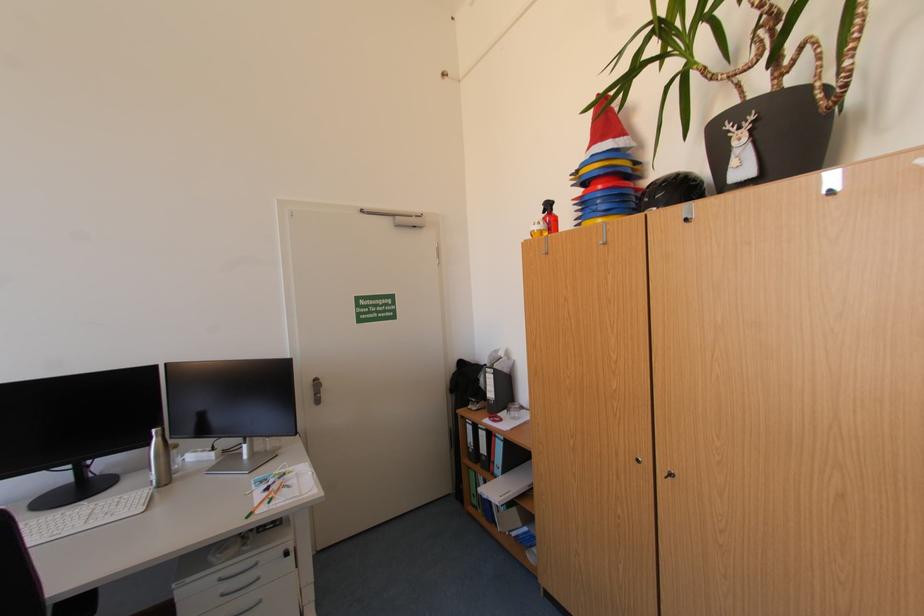
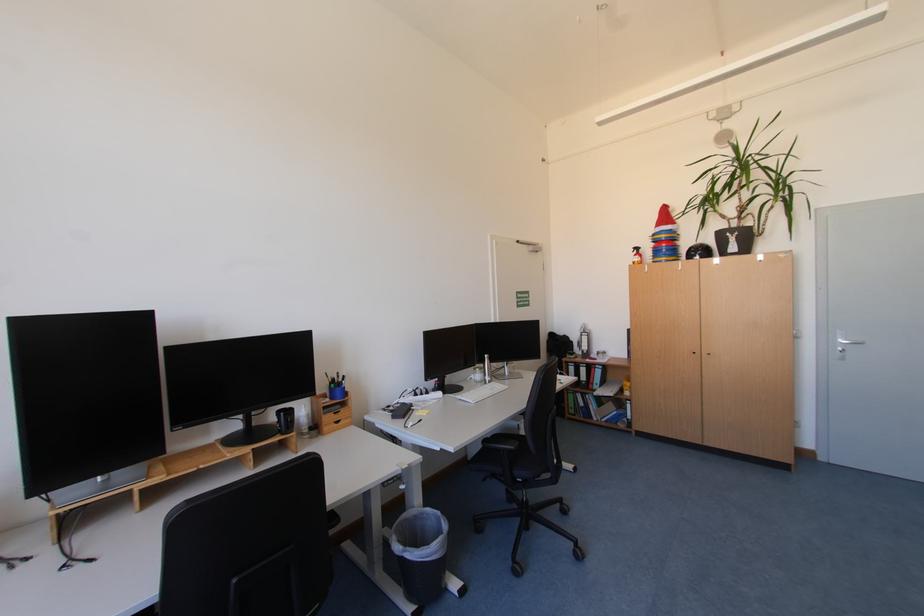
The point at (501, 438) is marked in the first image. Where is the corresponding point in the second image?

(601, 370)